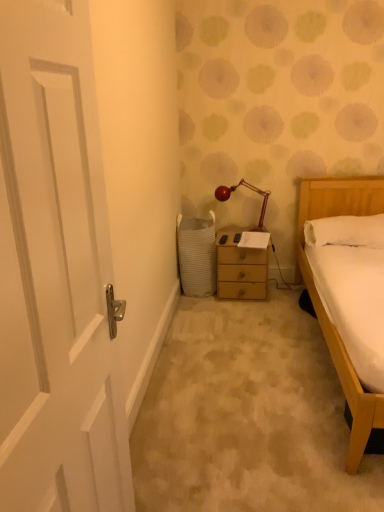
Where is `white soft pillow at right`? white soft pillow at right is located at coordinates (346, 231).

In order to face wooden nightstand at center, should I rotate leftwards or rightwards?

Turn right approximately 6.734 degrees to face it.

The height and width of the screenshot is (512, 384). Describe the element at coordinates (240, 267) in the screenshot. I see `wooden nightstand at center` at that location.

The height and width of the screenshot is (512, 384). What do you see at coordinates (250, 189) in the screenshot?
I see `metallic red lamp at center` at bounding box center [250, 189].

You are a GUI agent. You are given a task and a screenshot of the screen. Output one action in this format:
    pyautogui.click(x=<x>, y=<y>)
    Task: Click on the white soft pillow at right
    This screenshot has height=512, width=384.
    Given the screenshot: What is the action you would take?
    pyautogui.click(x=346, y=231)

Which point is more distant from viewer, (208, 244) or (80, 135)?

The point (208, 244) is more distant.

Could you tell me if white woven laundry basket at lower center is turned towards white glossy door at left?

Yes, white woven laundry basket at lower center is turned towards white glossy door at left.

Is white woven laundry basket at lower center to the right of white glossy door at left from the viewer's perspective?

Correct, you'll find white woven laundry basket at lower center to the right of white glossy door at left.

From a real-world perspective, is white soft pillow at right located higher than white woven laundry basket at lower center?

Yes, from a real-world perspective, white soft pillow at right is on top of white woven laundry basket at lower center.

Based on the photo, is white soft pillow at right not within white woven laundry basket at lower center?

Absolutely, white soft pillow at right is external to white woven laundry basket at lower center.

Is point (359, 231) more distant than point (180, 275)?

No, (359, 231) is in front of (180, 275).

Is white soft pillow at right far away from white woven laundry basket at lower center?

No.

From a real-world perspective, is white glossy door at left positioned under metallic red lamp at center based on gravity?

Actually, white glossy door at left is physically above metallic red lamp at center in the real world.

Between white glossy door at left and metallic red lamp at center, which one is positioned behind?

metallic red lamp at center is behind.

Based on the photo, can you tell me how much white glossy door at left and metallic red lamp at center differ in facing direction?

There is a 76.3-degree angle between the facing directions of white glossy door at left and metallic red lamp at center.

Which is correct: white glossy door at left is inside metallic red lamp at center, or outside of it?

white glossy door at left is located beyond the bounds of metallic red lamp at center.

From a real-world perspective, is white woven laundry basket at lower center physically located above or below white soft pillow at right?

From a real-world perspective, white woven laundry basket at lower center is physically below white soft pillow at right.

At what (x,y) coordinates should I click in order to perform the action: click on laundry basket below the white soft pillow at right (from a real-world perspective). Please return your answer as a coordinate pair (x, y). Image resolution: width=384 pixels, height=512 pixels. Looking at the image, I should click on (197, 255).

Is white woven laundry basket at lower center oriented away from white soft pillow at right?

No, white woven laundry basket at lower center is not facing the opposite direction of white soft pillow at right.

From the picture: Considering the sizes of objects white woven laundry basket at lower center and white soft pillow at right in the image provided, who is taller, white woven laundry basket at lower center or white soft pillow at right?

With more height is white woven laundry basket at lower center.

Which point is more forward, (332, 239) or (221, 193)?

The point (332, 239) is closer.

Considering the positions of objects white soft pillow at right and metallic red lamp at center in the image provided, who is more to the right, white soft pillow at right or metallic red lamp at center?

white soft pillow at right.

Would you say metallic red lamp at center is part of white soft pillow at right's contents?

No, metallic red lamp at center is not surrounded by white soft pillow at right.

Is the position of white soft pillow at right less distant than that of metallic red lamp at center?

Yes.

Considering the relative sizes of wooden nightstand at center and metallic red lamp at center in the image provided, is wooden nightstand at center taller than metallic red lamp at center?

Yes.

Is there a large distance between wooden nightstand at center and metallic red lamp at center?

No, wooden nightstand at center is not far away from metallic red lamp at center.

Identify the location of nightstand below the metallic red lamp at center (from the image's perspective). (240, 267).

Between point (205, 232) and point (252, 185), which one is positioned behind?

The point (252, 185) is more distant.

How many degrees apart are the facing directions of white woven laundry basket at lower center and metallic red lamp at center?

They differ by 11.2 degrees in their facing directions.

Are white woven laundry basket at lower center and metallic red lamp at center making contact?

No, white woven laundry basket at lower center is not with metallic red lamp at center.

I want to click on door above the white woven laundry basket at lower center (from a real-world perspective), so click(55, 272).

You are a GUI agent. You are given a task and a screenshot of the screen. Output one action in this format:
    pyautogui.click(x=<x>, y=<y>)
    Task: Click on the laundry basket that is below the white soft pillow at right (from the image's perspective)
    
    Given the screenshot: What is the action you would take?
    pyautogui.click(x=197, y=255)

Which object lies nearer to the anchor point white glossy door at left, white woven laundry basket at lower center or metallic red lamp at center?

The object closer to white glossy door at left is white woven laundry basket at lower center.

Considering their positions, is metallic red lamp at center positioned closer to wooden nightstand at center than white soft pillow at right?

metallic red lamp at center lies closer to wooden nightstand at center than the other object.

Considering their positions, is metallic red lamp at center positioned further to wooden nightstand at center than white glossy door at left?

The object further to wooden nightstand at center is white glossy door at left.

Considering their positions, is wooden nightstand at center positioned further to white soft pillow at right than white woven laundry basket at lower center?

Among the two, white woven laundry basket at lower center is located further to white soft pillow at right.

Based on their spatial positions, is white glossy door at left or metallic red lamp at center further from white woven laundry basket at lower center?

white glossy door at left is further to white woven laundry basket at lower center.

From the image, which object appears to be nearer to white soft pillow at right, white woven laundry basket at lower center or metallic red lamp at center?

Based on the image, metallic red lamp at center appears to be nearer to white soft pillow at right.

Considering their positions, is metallic red lamp at center positioned further to white woven laundry basket at lower center than white glossy door at left?

white glossy door at left.

When comparing their distances from white soft pillow at right, does metallic red lamp at center or white woven laundry basket at lower center seem further?

Among the two, white woven laundry basket at lower center is located further to white soft pillow at right.

Find the location of a particular element. This screenshot has width=384, height=512. pillow between white glossy door at left and white woven laundry basket at lower center along the z-axis is located at coordinates (346, 231).

Locate an element on the screen. Image resolution: width=384 pixels, height=512 pixels. laundry basket between white glossy door at left and metallic red lamp at center from front to back is located at coordinates (197, 255).

At what (x,y) coordinates should I click in order to perform the action: click on lamp between white woven laundry basket at lower center and white soft pillow at right in the horizontal direction. Please return your answer as a coordinate pair (x, y). This screenshot has height=512, width=384. Looking at the image, I should click on (250, 189).

The image size is (384, 512). Find the location of `nightstand situated between metallic red lamp at center and white soft pillow at right from left to right`. nightstand situated between metallic red lamp at center and white soft pillow at right from left to right is located at coordinates (240, 267).